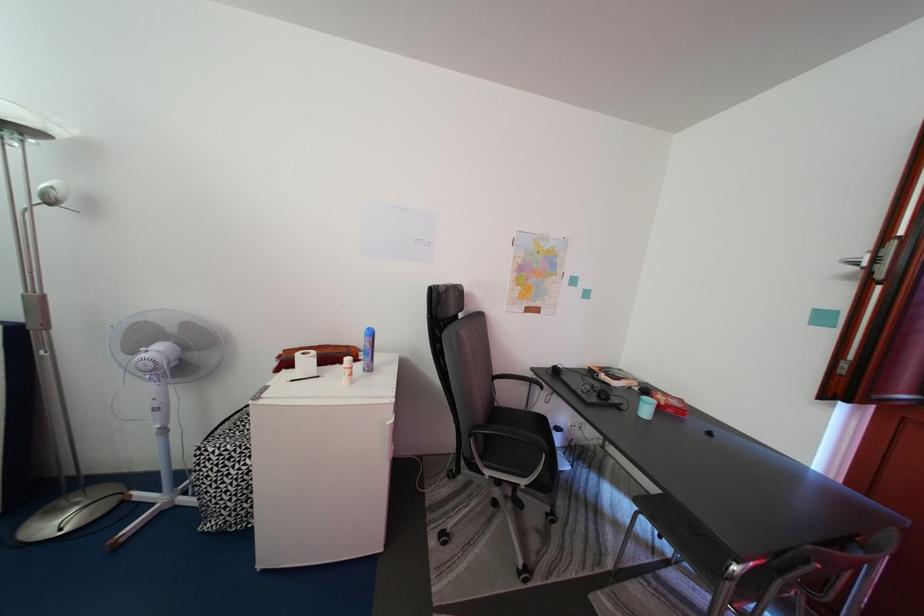
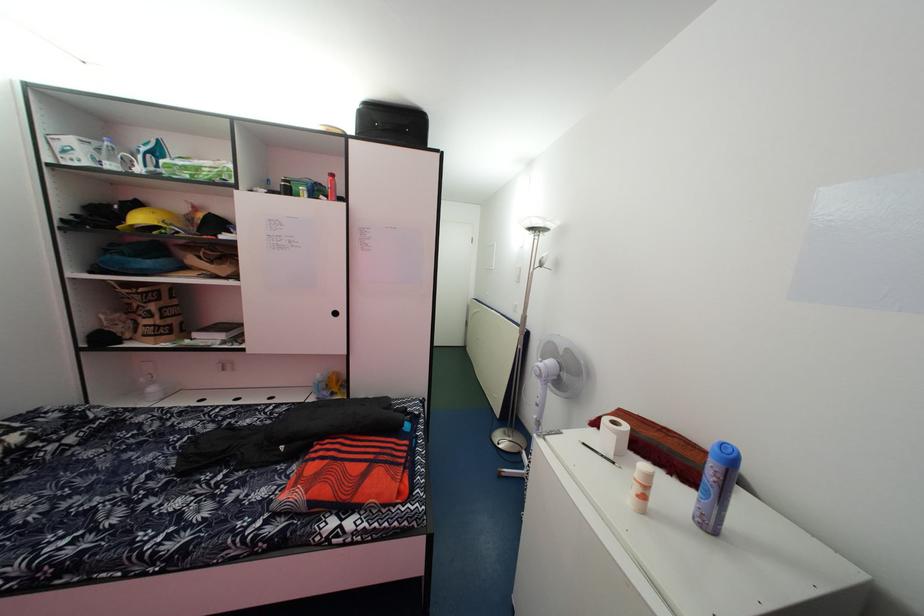
Question: The camera is either moving clockwise (left) or counter-clockwise (right) around the object. The first image is from the beginning of the video and the second image is from the end. Is the camera moving left or right when shooting the video?

Choices:
 (A) Left
 (B) Right

Answer: (B)